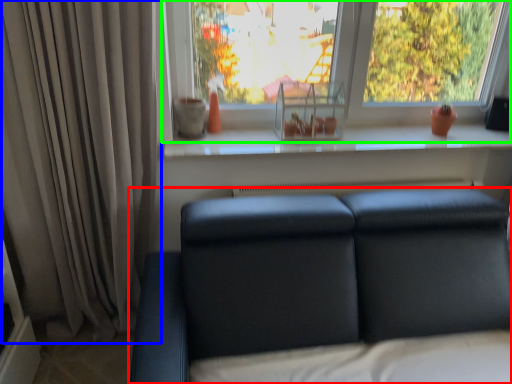
Question: Which object is the farthest from studio couch (highlighted by a red box)? Choose among these: curtain (highlighted by a blue box) or window (highlighted by a green box).

Choices:
 (A) curtain
 (B) window

Answer: (B)